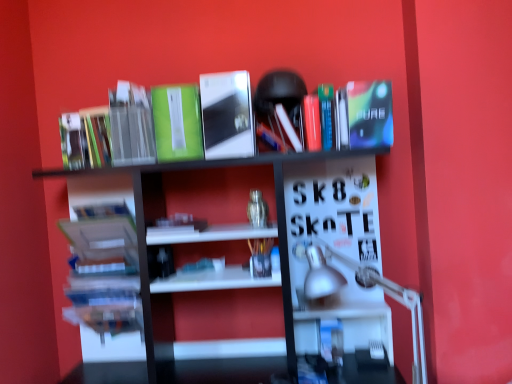
Question: Considering the relative sizes of translucent plastic pen holder at center, which appears as the 1th book when viewed from the right, and white glossy bookshelf at upper center in the image provided, is translucent plastic pen holder at center, which appears as the 1th book when viewed from the right, shorter than white glossy bookshelf at upper center?

Choices:
 (A) no
 (B) yes

Answer: (B)

Question: Is translucent plastic pen holder at center, which appears as the 1th book when viewed from the right, positioned far away from white glossy bookshelf at upper center?

Choices:
 (A) yes
 (B) no

Answer: (B)

Question: Could you tell me if translucent plastic pen holder at center, which appears as the 5th book when viewed from the left, is turned towards white glossy bookshelf at upper center?

Choices:
 (A) no
 (B) yes

Answer: (B)

Question: Does translucent plastic pen holder at center, which appears as the 5th book when viewed from the left, have a greater width compared to white glossy bookshelf at upper center?

Choices:
 (A) yes
 (B) no

Answer: (B)

Question: From a real-world perspective, is translucent plastic pen holder at center, which appears as the 5th book when viewed from the left, under white glossy bookshelf at upper center?

Choices:
 (A) yes
 (B) no

Answer: (B)

Question: From their relative heights in the image, would you say silver metallic table lamp at lower right is taller or shorter than green matte book at upper center, which ranks as the 2th paperback book in left-to-right order?

Choices:
 (A) short
 (B) tall

Answer: (B)

Question: From the image's perspective, is silver metallic table lamp at lower right located above or below green matte book at upper center, which ranks as the 2th paperback book in left-to-right order?

Choices:
 (A) below
 (B) above

Answer: (A)

Question: Considering the positions of silver metallic table lamp at lower right and green matte book at upper center, the third paperback book from the right, in the image, is silver metallic table lamp at lower right wider or thinner than green matte book at upper center, the third paperback book from the right,?

Choices:
 (A) wide
 (B) thin

Answer: (A)

Question: Is point (315, 289) positioned closer to the camera than point (196, 150)?

Choices:
 (A) farther
 (B) closer

Answer: (A)

Question: Considering their positions, is hardcover books at left, positioned as the 2th book in left-to-right order, located in front of or behind green matte book at upper left, positioned as the fourth paperback book in right-to-left order?

Choices:
 (A) front
 (B) behind

Answer: (B)

Question: Is point (74, 238) closer or farther from the camera than point (135, 145)?

Choices:
 (A) farther
 (B) closer

Answer: (A)

Question: Looking at their shapes, would you say hardcover books at left, which is the 4th book in right-to-left order, is wider or thinner than green matte book at upper left, positioned as the fourth paperback book in right-to-left order?

Choices:
 (A) thin
 (B) wide

Answer: (A)

Question: Is hardcover books at left, positioned as the 2th book in left-to-right order, to the left or to the right of green matte book at upper left, which appears as the 1th paperback book when viewed from the left, in the image?

Choices:
 (A) right
 (B) left

Answer: (B)

Question: Is point (104, 294) closer or farther from the camera than point (65, 120)?

Choices:
 (A) farther
 (B) closer

Answer: (A)

Question: From a real-world perspective, is hardcover books at left, positioned as the 2th book in left-to-right order, physically located above or below matte green book at upper left, which is counted as the 5th book, starting from the right?

Choices:
 (A) above
 (B) below

Answer: (B)